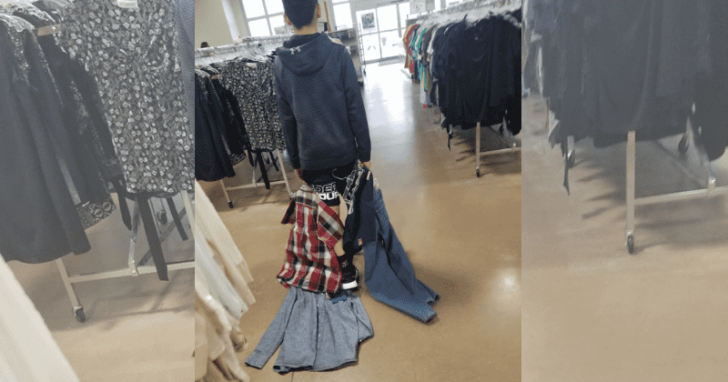
Image resolution: width=728 pixels, height=382 pixels. I want to click on white metal legs of clothing racks, so click(x=282, y=175), click(x=477, y=147).